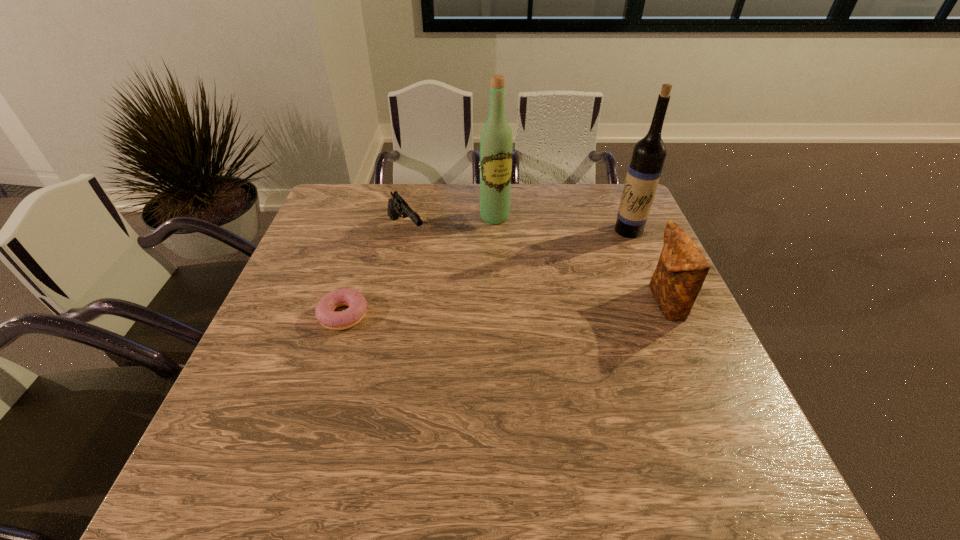
You are a GUI agent. You are given a task and a screenshot of the screen. Output one action in this format:
    pyautogui.click(x=<x>, y=<y>)
    Task: Click on the free space on the desktop that is between the doughnut and the clutch bag and is positioned at the end of the barrel of the gun
    Image resolution: width=960 pixels, height=540 pixels.
    Given the screenshot: What is the action you would take?
    pyautogui.click(x=474, y=310)

The image size is (960, 540). In order to click on free space on the desktop that is between the shortest object and the clutch bag and is positioned on the front-facing side of the left wine bottle in this screenshot , I will do `click(547, 308)`.

At what (x,y) coordinates should I click in order to perform the action: click on vacant space on the desktop that is between the shortest object and the clutch bag and is positioned on the label of the right wine bottle. Please return your answer as a coordinate pair (x, y). Looking at the image, I should click on 480,310.